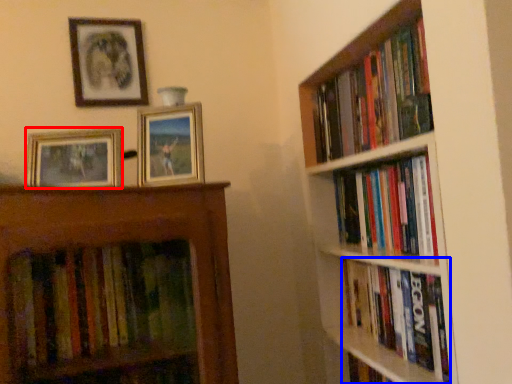
Question: Among these objects, which one is farthest to the camera, picture frame (highlighted by a red box) or book (highlighted by a blue box)?

Choices:
 (A) picture frame
 (B) book

Answer: (A)